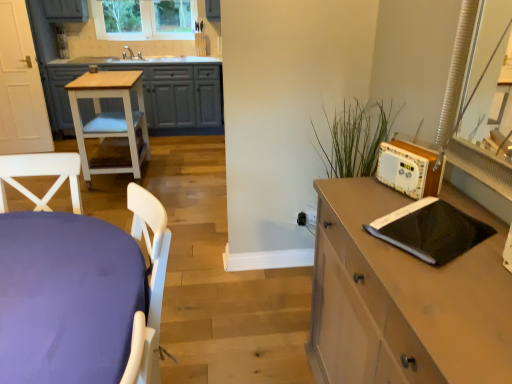
This screenshot has width=512, height=384. Find the location of `free space to the back side of black matte notebook at right`. free space to the back side of black matte notebook at right is located at coordinates (373, 195).